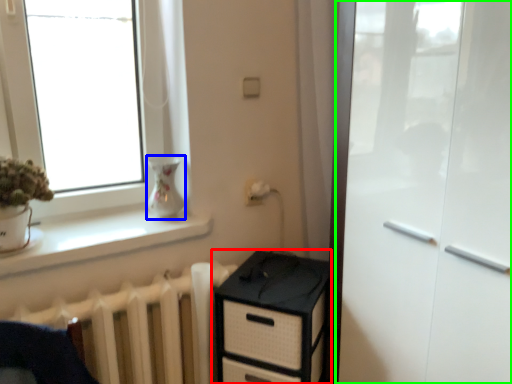
Question: Which is farther away from chest of drawers (highlighted by a red box)? vase (highlighted by a blue box) or screen door (highlighted by a green box)?

Choices:
 (A) vase
 (B) screen door

Answer: (A)